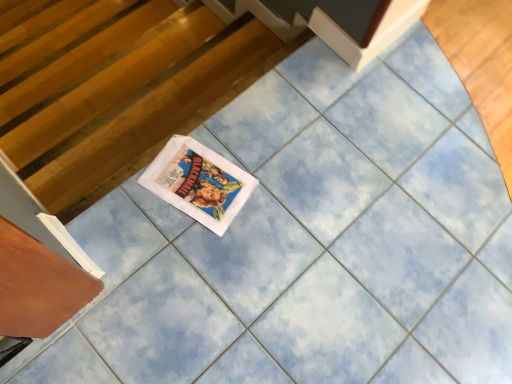
The height and width of the screenshot is (384, 512). I want to click on free spot in front of wooden drawer at lower left, so click(53, 361).